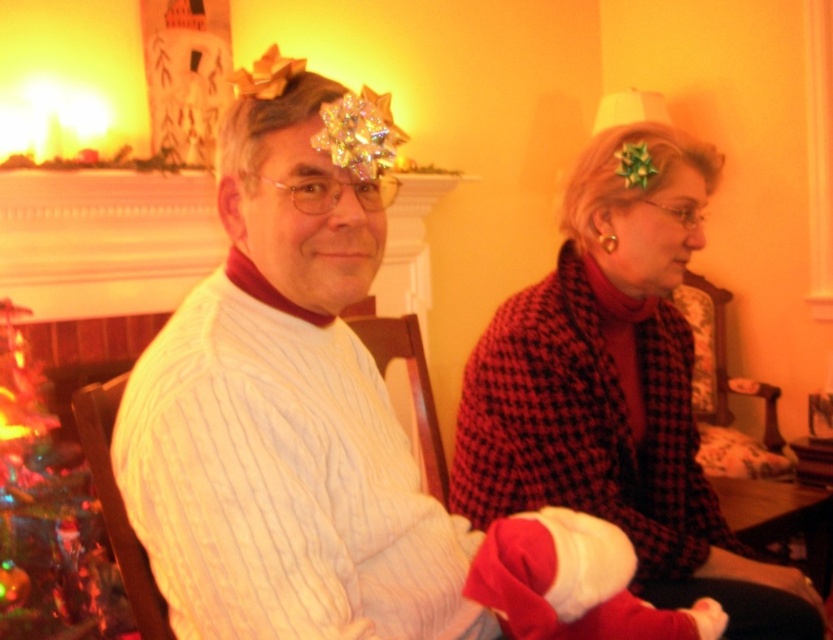
You are a photographer adjusting the camera settings to capture the festive scene. The camera is positioned to focus on the man with the gold bow. To ensure the red houndstooth shawl at center is in the frame, where should you position the camera relative to the man?

The red houndstooth shawl at center is located at point (617, 388), so positioning the camera to focus on the man with the gold bow while ensuring the shawl is within the frame would require aligning the camera so that both the man and the shawl are visible. Since the coordinates indicate the shawl is near the lower central part of the image, the camera should be positioned slightly above and behind the man to include the shawl in the shot.

Based on the photo, you are planning to place a new ornament on the tallest object between the green artificial christmas tree at lower left and the red velvet santa hat at lower center. Which object should you choose?

The green artificial christmas tree at lower left has a larger size compared to the red velvet santa hat at lower center, so you should choose the green artificial christmas tree at lower left to place the ornament.

You are a delivery robot that is 1.2 meters wide. You are in the living room and need to move from the red houndstooth shawl at center to the green artificial christmas tree at lower left. Can you fit through the space between them?

The distance between the red houndstooth shawl at center and the green artificial christmas tree at lower left is 1.48 meters. Since the robot is 1.2 meters wide, it can fit through the space between them as the distance is wider than the robot.